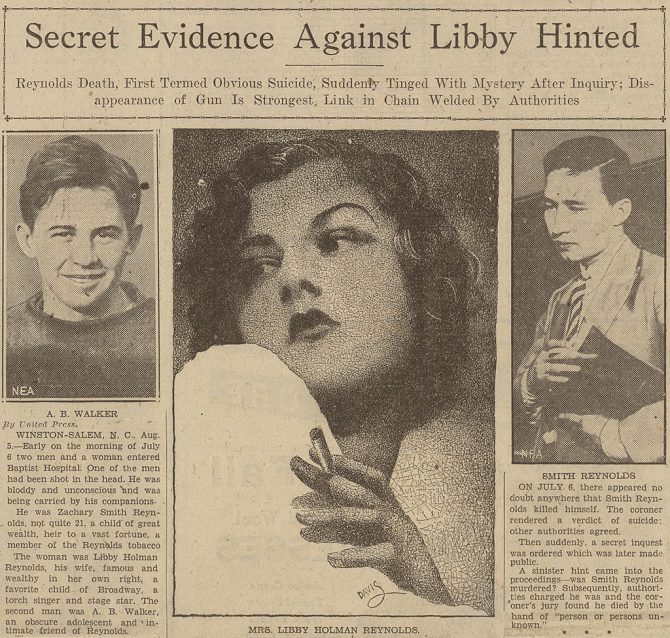
Locate an element on the screen. This screenshot has height=638, width=670. picture is located at coordinates (299, 469).